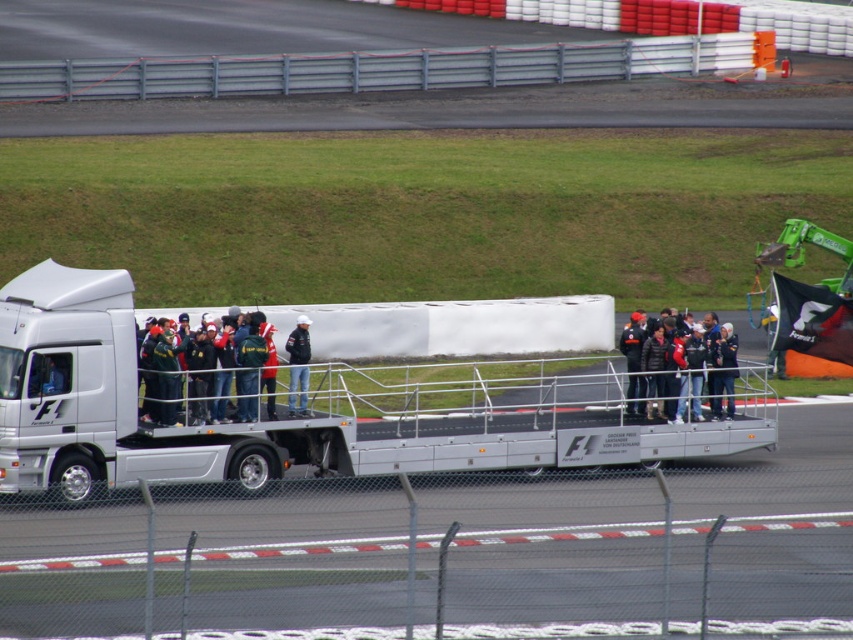
You are a photographer standing at the center of the F1 race track. You want to take a photo that includes both the point at coordinates point (234,356) and point (305,358). Which point should you focus on first to ensure both are in sharp focus?

You should focus on point (234,356) first because it is closer to the camera than point (305,358), ensuring both points are within the depth of field.